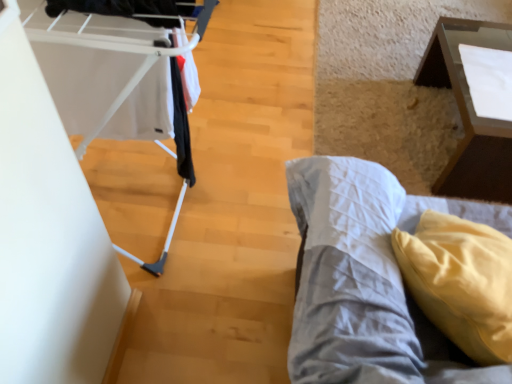
Describe the element at coordinates (368, 280) in the screenshot. Image resolution: width=512 pixels, height=384 pixels. I see `yellow fabric pillow at lower right` at that location.

Find the location of a particular element. The width and height of the screenshot is (512, 384). transparent glass table at upper right is located at coordinates coord(470,113).

Considering the relative sizes of transparent glass table at upper right and yellow fabric pillow at lower right in the image provided, is transparent glass table at upper right smaller than yellow fabric pillow at lower right?

No, transparent glass table at upper right is not smaller than yellow fabric pillow at lower right.

Based on their positions, is transparent glass table at upper right located to the left or right of yellow fabric pillow at lower right?

→ From the image, it's evident that transparent glass table at upper right is to the right of yellow fabric pillow at lower right.

You are a GUI agent. You are given a task and a screenshot of the screen. Output one action in this format:
    pyautogui.click(x=<x>, y=<y>)
    Task: Click on the table lying behind the yellow fabric pillow at lower right
    This screenshot has height=384, width=512.
    Given the screenshot: What is the action you would take?
    pyautogui.click(x=470, y=113)

From the image's perspective, which is below, transparent glass table at upper right or yellow fabric pillow at lower right?

yellow fabric pillow at lower right is shown below in the image.

What are the coordinates of `table that appears above the white plastic baby carriage at left (from the image's perspective)` in the screenshot? It's located at (470, 113).

Is white plastic baby carriage at left wider than transparent glass table at upper right?

No, white plastic baby carriage at left is not wider than transparent glass table at upper right.

Does white plastic baby carriage at left appear on the right side of transparent glass table at upper right?

No, white plastic baby carriage at left is not to the right of transparent glass table at upper right.

Is point (50, 25) less distant than point (432, 66)?

Yes, point (50, 25) is in front of point (432, 66).

Does yellow fabric pillow at lower right touch transparent glass table at upper right?

No, yellow fabric pillow at lower right is not making contact with transparent glass table at upper right.

In the scene shown: From the image's perspective, is yellow fabric pillow at lower right below transparent glass table at upper right?

Indeed, from the image's perspective, yellow fabric pillow at lower right is shown beneath transparent glass table at upper right.

What's the angular difference between yellow fabric pillow at lower right and transparent glass table at upper right's facing directions?

36 degrees separate the facing orientations of yellow fabric pillow at lower right and transparent glass table at upper right.

The width and height of the screenshot is (512, 384). What are the coordinates of `furniture above the transparent glass table at upper right (from a real-world perspective)` in the screenshot? It's located at (368, 280).

Considering the sizes of objects transparent glass table at upper right and white plastic baby carriage at left in the image provided, who is smaller, transparent glass table at upper right or white plastic baby carriage at left?

With smaller size is white plastic baby carriage at left.

In the scene shown: Is transparent glass table at upper right to the left or to the right of white plastic baby carriage at left in the image?

Clearly, transparent glass table at upper right is on the right of white plastic baby carriage at left in the image.

In the image, is transparent glass table at upper right positioned in front of or behind white plastic baby carriage at left?

In the image, transparent glass table at upper right appears behind white plastic baby carriage at left.

From a real-world perspective, between transparent glass table at upper right and white plastic baby carriage at left, who is vertically higher?

From a 3D spatial view, white plastic baby carriage at left is above.

Does yellow fabric pillow at lower right have a greater height compared to white plastic baby carriage at left?

Incorrect, the height of yellow fabric pillow at lower right is not larger of that of white plastic baby carriage at left.

Is yellow fabric pillow at lower right positioned with its back to white plastic baby carriage at left?

yellow fabric pillow at lower right is not turned away from white plastic baby carriage at left.

Does point (374, 332) come behind point (180, 66)?

No.

Is white plastic baby carriage at left positioned in front of yellow fabric pillow at lower right?

That is False.

From the image's perspective, which one is positioned lower, white plastic baby carriage at left or yellow fabric pillow at lower right?

yellow fabric pillow at lower right.

Is white plastic baby carriage at left beside yellow fabric pillow at lower right?

No, white plastic baby carriage at left is not in contact with yellow fabric pillow at lower right.

From a real-world perspective, is white plastic baby carriage at left positioned over yellow fabric pillow at lower right based on gravity?

Yes.

The image size is (512, 384). I want to click on table above the yellow fabric pillow at lower right (from the image's perspective), so click(x=470, y=113).

Find the location of a particular element. This screenshot has height=384, width=512. table behind the white plastic baby carriage at left is located at coordinates (470, 113).

Based on their spatial positions, is white plastic baby carriage at left or transparent glass table at upper right further from yellow fabric pillow at lower right?

The object further to yellow fabric pillow at lower right is transparent glass table at upper right.

Based on their spatial positions, is transparent glass table at upper right or yellow fabric pillow at lower right further from white plastic baby carriage at left?

Among the two, transparent glass table at upper right is located further to white plastic baby carriage at left.

From the image, which object appears to be nearer to transparent glass table at upper right, yellow fabric pillow at lower right or white plastic baby carriage at left?

The object closer to transparent glass table at upper right is yellow fabric pillow at lower right.

From the image, which object appears to be nearer to yellow fabric pillow at lower right, transparent glass table at upper right or white plastic baby carriage at left?

white plastic baby carriage at left.

Which object lies further to the anchor point transparent glass table at upper right, white plastic baby carriage at left or yellow fabric pillow at lower right?

white plastic baby carriage at left.

Estimate the real-world distances between objects in this image. Which object is closer to white plastic baby carriage at left, yellow fabric pillow at lower right or transparent glass table at upper right?

Among the two, yellow fabric pillow at lower right is located nearer to white plastic baby carriage at left.

The width and height of the screenshot is (512, 384). What are the coordinates of `furniture located between white plastic baby carriage at left and transparent glass table at upper right in the left-right direction` in the screenshot? It's located at (368, 280).